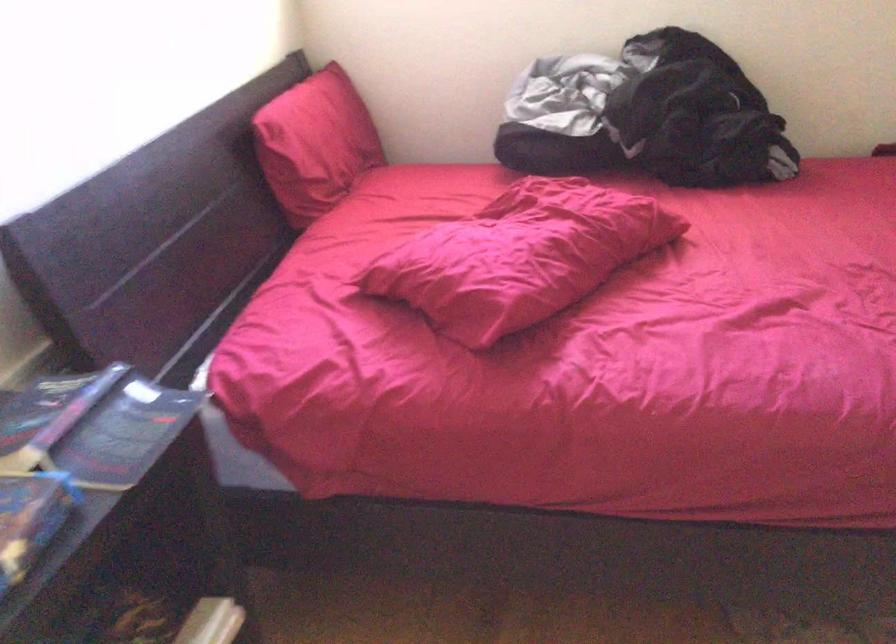
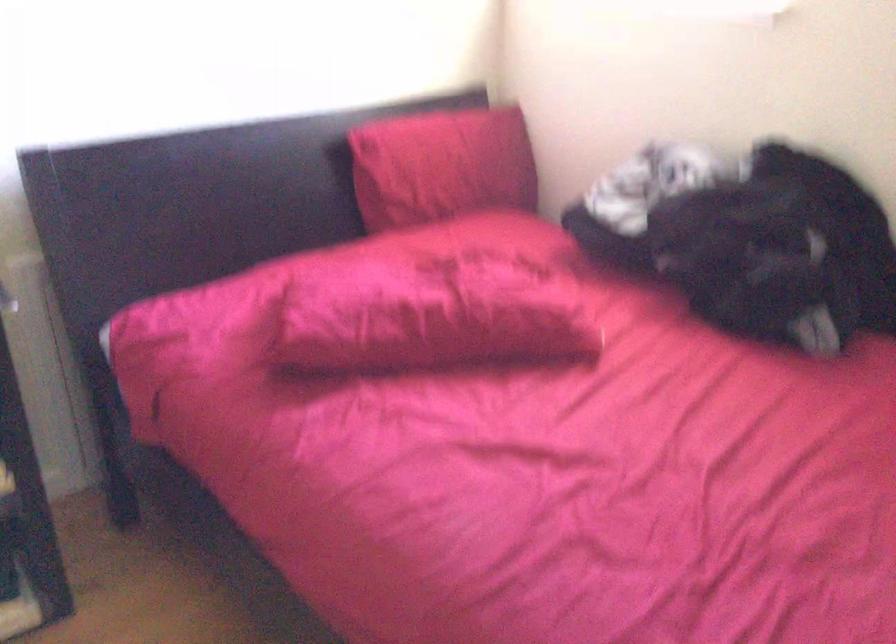
In the second image, find the point that corresponds to (x=340, y=138) in the first image.

(442, 166)